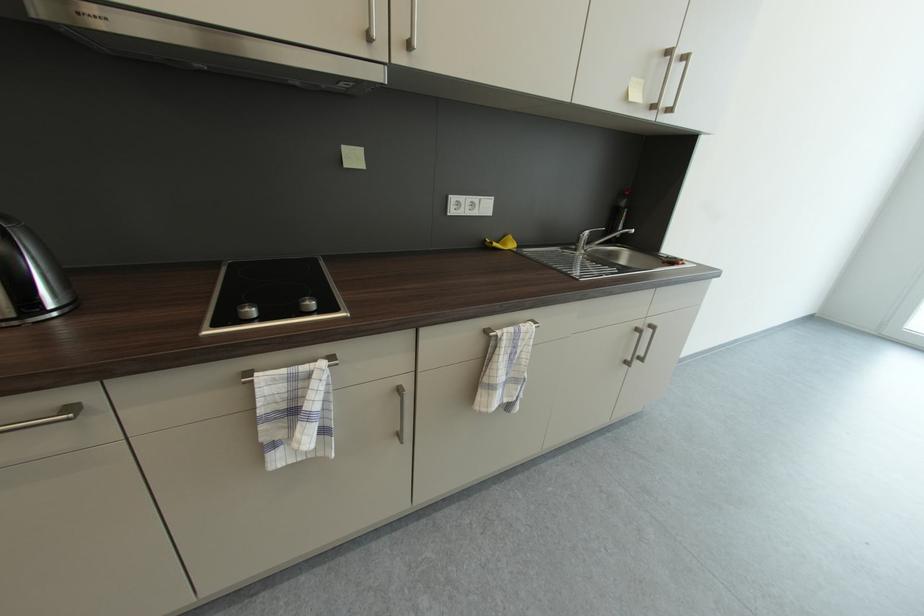
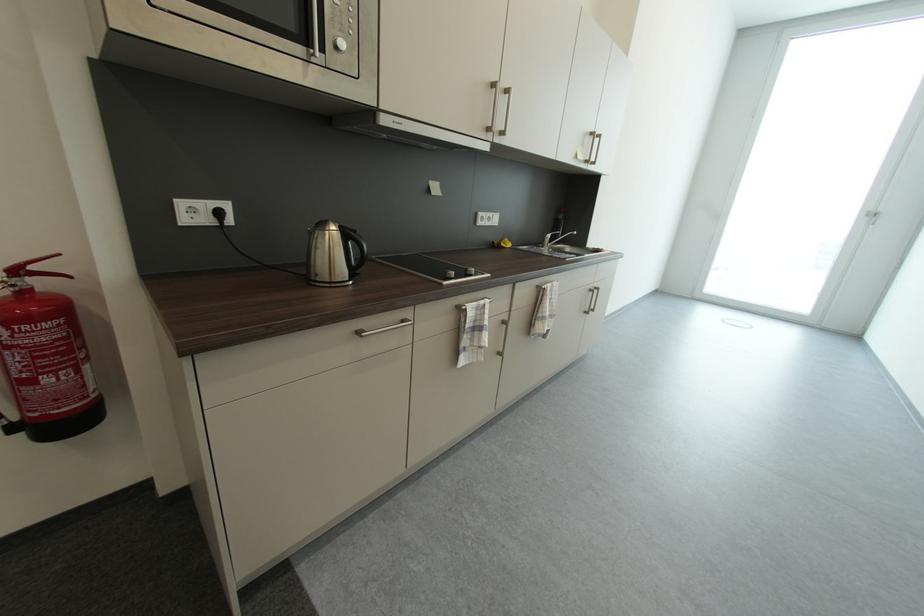
Which direction would the cameraman need to move to produce the second image?

The movement direction of the cameraman is left, backward.